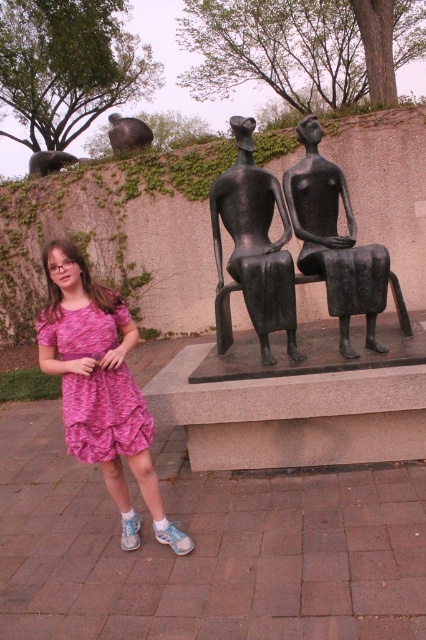
Who is more distant from viewer, (132, 323) or (146, 426)?

Positioned behind is point (132, 323).

Between point (118, 444) and point (111, 314), which one is positioned in front?

Positioned in front is point (118, 444).

Who is more distant from viewer, (83, 273) or (83, 397)?

The point (83, 273) is behind.

Where is `pink fabric dress at lower left`? Image resolution: width=426 pixels, height=640 pixels. pink fabric dress at lower left is located at coordinates (100, 387).

Is bronze sculpture at center further to camera compared to pink textured dress at lower left?

Yes, it is.

Based on the photo, is bronze sculpture at center bigger than pink textured dress at lower left?

Yes, bronze sculpture at center is bigger than pink textured dress at lower left.

Image resolution: width=426 pixels, height=640 pixels. Describe the element at coordinates (256, 243) in the screenshot. I see `bronze sculpture at center` at that location.

Where is `bronze sculpture at center`? The image size is (426, 640). bronze sculpture at center is located at coordinates (256, 243).

Can you confirm if pink fabric dress at lower left is thinner than bronze statue at upper center?

Correct, pink fabric dress at lower left's width is less than bronze statue at upper center's.

Does pink fabric dress at lower left have a lesser height compared to bronze statue at upper center?

No, pink fabric dress at lower left is not shorter than bronze statue at upper center.

The width and height of the screenshot is (426, 640). Identify the location of pink fabric dress at lower left. (100, 387).